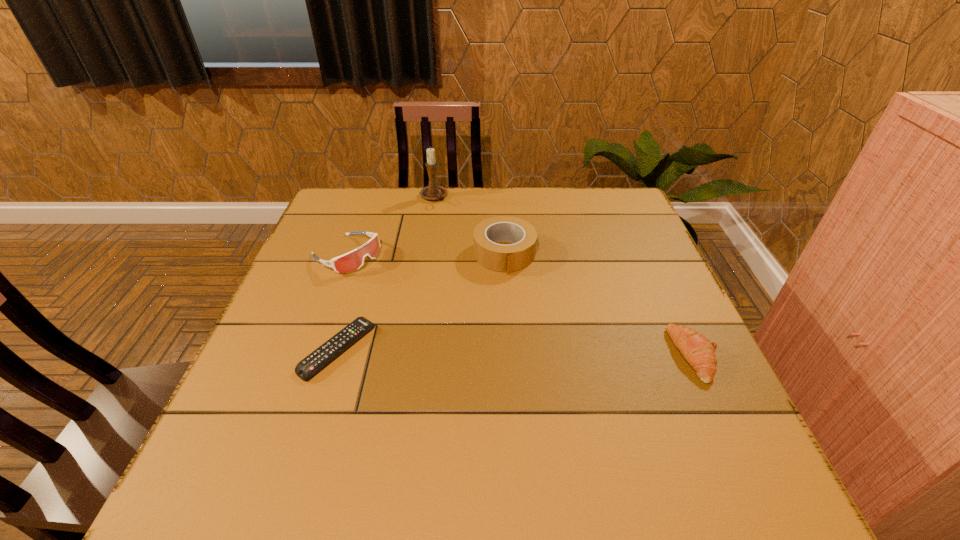
Identify the location of free space on the desktop that is between the shortest object and the second shortest object and is positioned at the edge of the duct tape. This screenshot has width=960, height=540. (530, 353).

Identify the location of free space on the desktop that is between the remote control and the second shortest object and is positioned on the side of the tallest object with the handle. (499, 352).

Locate an element on the screen. The height and width of the screenshot is (540, 960). vacant space on the desktop that is between the shortest object and the second shortest object and is positioned on the front-facing side of the goggles is located at coordinates (506, 352).